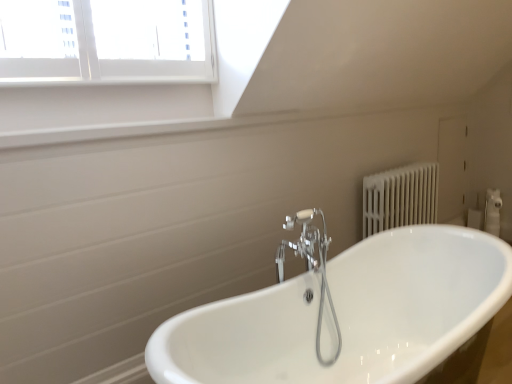
The height and width of the screenshot is (384, 512). What are the coordinates of `white glossy bathtub at center` in the screenshot? It's located at (351, 316).

What do you see at coordinates (351, 316) in the screenshot? The height and width of the screenshot is (384, 512). I see `white glossy bathtub at center` at bounding box center [351, 316].

What do you see at coordinates (311, 266) in the screenshot?
I see `chrome metallic faucet at center` at bounding box center [311, 266].

Image resolution: width=512 pixels, height=384 pixels. I want to click on chrome metallic faucet at center, so click(x=311, y=266).

Locate an element on the screen. Image resolution: width=512 pixels, height=384 pixels. white glossy bathtub at center is located at coordinates [351, 316].

Which is more to the right, chrome metallic faucet at center or white glossy bathtub at center?

white glossy bathtub at center is more to the right.

Is the depth of chrome metallic faucet at center less than that of white glossy bathtub at center?

No, it is behind white glossy bathtub at center.

Does point (297, 214) come in front of point (460, 272)?

No.

From the image's perspective, which one is positioned lower, chrome metallic faucet at center or white glossy bathtub at center?

white glossy bathtub at center appears lower in the image.

From a real-world perspective, is chrome metallic faucet at center located higher than white glossy bathtub at center?

Yes, from a real-world perspective, chrome metallic faucet at center is above white glossy bathtub at center.

Considering the relative sizes of chrome metallic faucet at center and white glossy bathtub at center in the image provided, is chrome metallic faucet at center thinner than white glossy bathtub at center?

Indeed, chrome metallic faucet at center has a lesser width compared to white glossy bathtub at center.

Is chrome metallic faucet at center taller or shorter than white glossy bathtub at center?

In the image, chrome metallic faucet at center appears to be taller than white glossy bathtub at center.

Considering the relative sizes of chrome metallic faucet at center and white glossy bathtub at center in the image provided, is chrome metallic faucet at center smaller than white glossy bathtub at center?

Yes, chrome metallic faucet at center is smaller than white glossy bathtub at center.

Would you say white glossy bathtub at center is part of chrome metallic faucet at center's contents?

No, white glossy bathtub at center is not a part of chrome metallic faucet at center.

Is chrome metallic faucet at center not close to white glossy bathtub at center?

No, chrome metallic faucet at center is not far away from white glossy bathtub at center.

Is chrome metallic faucet at center oriented away from white glossy bathtub at center?

That's not correct — chrome metallic faucet at center is not looking away from white glossy bathtub at center.

At what (x,y) coordinates should I click in order to perform the action: click on tap behind the white glossy bathtub at center. Please return your answer as a coordinate pair (x, y). The height and width of the screenshot is (384, 512). Looking at the image, I should click on (311, 266).

Can you confirm if white glossy bathtub at center is positioned to the right of chrome metallic faucet at center?

Yes, white glossy bathtub at center is to the right of chrome metallic faucet at center.

Is white glossy bathtub at center further to the viewer compared to chrome metallic faucet at center?

No.

Does point (275, 300) come closer to viewer compared to point (324, 256)?

Yes, point (275, 300) is in front of point (324, 256).

Looking at this image, from the image's perspective, is white glossy bathtub at center located above chrome metallic faucet at center?

No, from the image's perspective, white glossy bathtub at center is not above chrome metallic faucet at center.

In the scene shown: From a real-world perspective, is white glossy bathtub at center physically located above or below chrome metallic faucet at center?

From a real-world perspective, white glossy bathtub at center is physically below chrome metallic faucet at center.

Which object is wider, white glossy bathtub at center or chrome metallic faucet at center?

white glossy bathtub at center.

Between white glossy bathtub at center and chrome metallic faucet at center, which one has more height?

With more height is chrome metallic faucet at center.

Can you confirm if white glossy bathtub at center is bigger than chrome metallic faucet at center?

Correct, white glossy bathtub at center is larger in size than chrome metallic faucet at center.

Would you say white glossy bathtub at center is outside chrome metallic faucet at center?

white glossy bathtub at center lies outside chrome metallic faucet at center's area.

Is there a large distance between white glossy bathtub at center and chrome metallic faucet at center?

white glossy bathtub at center is near chrome metallic faucet at center, not far away.

Does white glossy bathtub at center turn towards chrome metallic faucet at center?

No, white glossy bathtub at center is not turned towards chrome metallic faucet at center.

What's the angular difference between white glossy bathtub at center and chrome metallic faucet at center's facing directions?

91.8 degrees separate the facing orientations of white glossy bathtub at center and chrome metallic faucet at center.

The width and height of the screenshot is (512, 384). I want to click on bathtub below the chrome metallic faucet at center (from the image's perspective), so click(x=351, y=316).

At what (x,y) coordinates should I click in order to perform the action: click on tap located above the white glossy bathtub at center (from the image's perspective). Please return your answer as a coordinate pair (x, y). Looking at the image, I should click on (311, 266).

In order to click on bathtub in front of the chrome metallic faucet at center in this screenshot , I will do `click(351, 316)`.